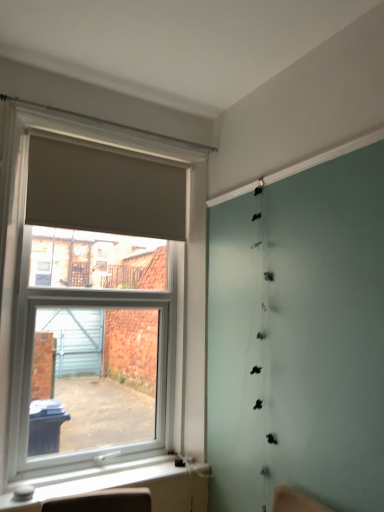
Find the location of a particular element. free spot above white plastic window sill at lower left (from a real-world perspective) is located at coordinates (113, 475).